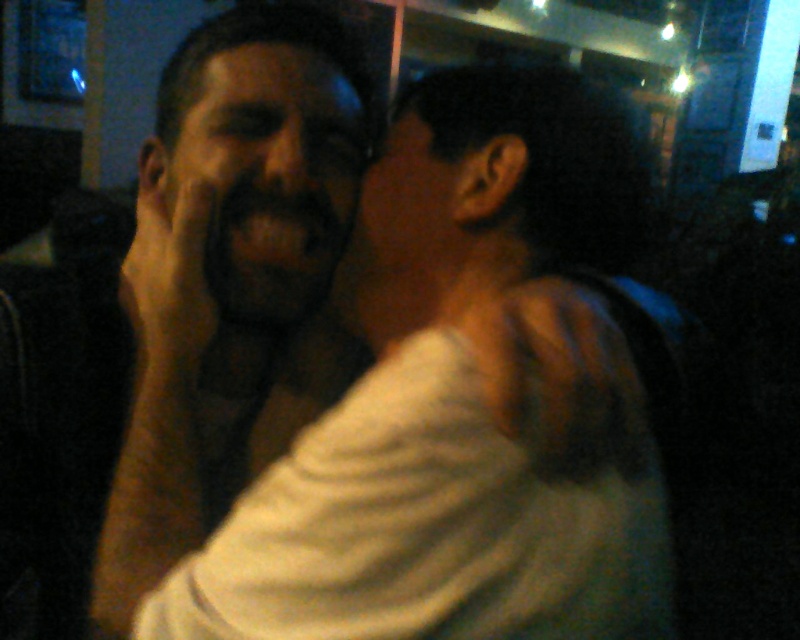
You are a photographer trying to adjust the lighting in the scene. You notice the matte white shirt at center and the dark matte face at center. Which object would reflect more light and why?

The matte white shirt at center would reflect more light because its white color and larger width compared to the dark matte face at center make it a better reflector of light in low light conditions.

You are standing in the dimly lit room and want to place a small decoration between the two points, point (594, 540) and point (277, 49). Which point should you place it closer to so it appears larger in the photo?

Place the decoration closer to point (594, 540) because it is closer to the camera, making the decoration appear larger in the photo.

You are a photographer trying to adjust the lighting in the scene. You notice the matte white shirt at center and the dark matte face at center. Which object should you focus your light source on to ensure proper exposure, considering their size in the frame?

The matte white shirt at center is much taller than the dark matte face at center, so focusing the light source on the matte white shirt at center would ensure proper exposure due to its larger size in the frame.